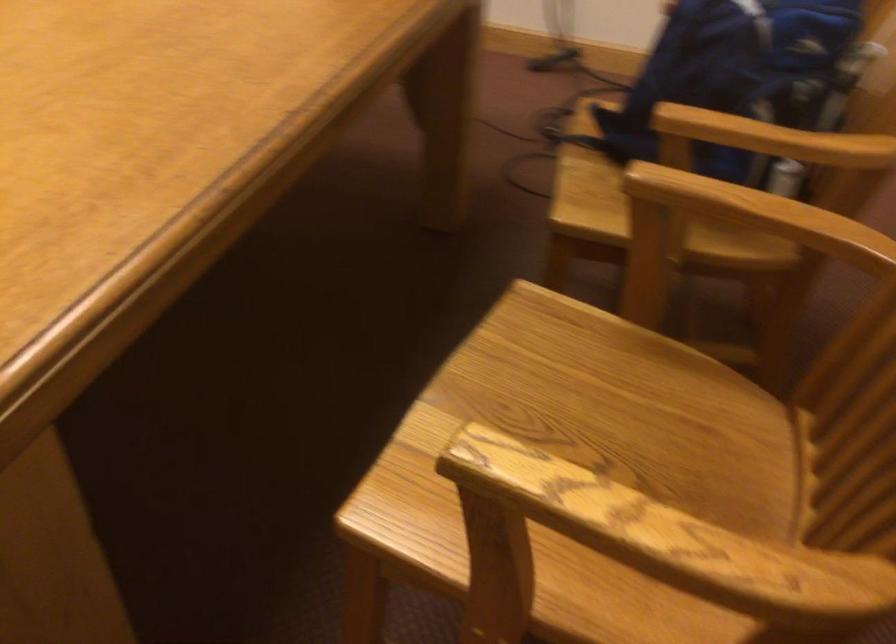
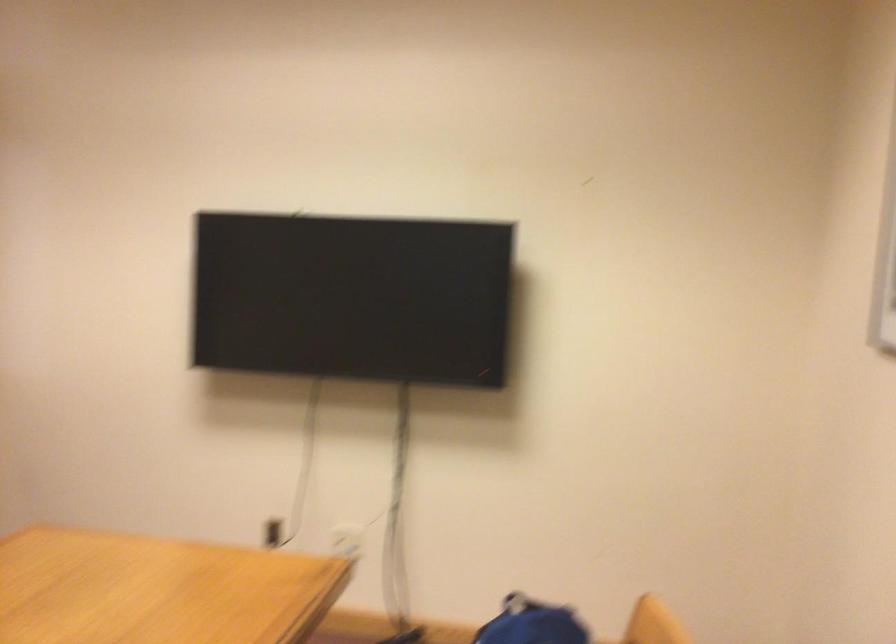
Question: Based on the continuous images, in which direction is the camera rotating? Reply with the corresponding letter.

Choices:
 (A) Left
 (B) Right
 (C) Up
 (D) Down

Answer: (C)